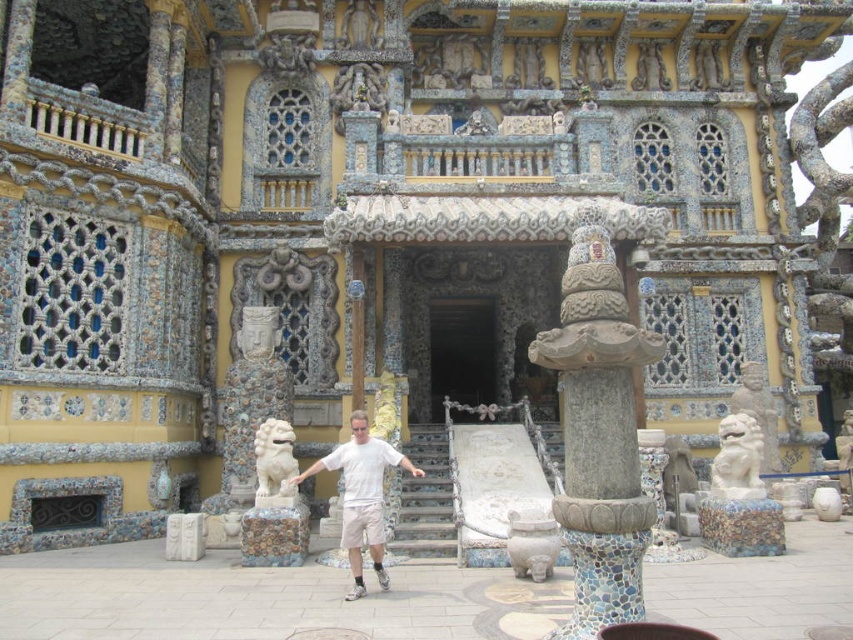
Question: Which point is closer to the camera?

Choices:
 (A) (281, 464)
 (B) (653, 61)

Answer: (A)

Question: Which point is farther to the camera?

Choices:
 (A) (283, 438)
 (B) (669, 467)
 (C) (618, 410)

Answer: (B)

Question: Does black stone door at center appear over white marble lion at right?

Choices:
 (A) no
 (B) yes

Answer: (B)

Question: Which object is the closest to the white stone lion at lower left?

Choices:
 (A) smooth stone statue at upper center
 (B) gray stone pillar at center
 (C) white marble lion at right
 (D) gray stone lion at center

Answer: (B)

Question: Is gray stone pillar at center to the right of carved stone statue at upper center from the viewer's perspective?

Choices:
 (A) yes
 (B) no

Answer: (B)

Question: Does gray stone pillar at center have a larger size compared to stone stairs at center?

Choices:
 (A) no
 (B) yes

Answer: (B)